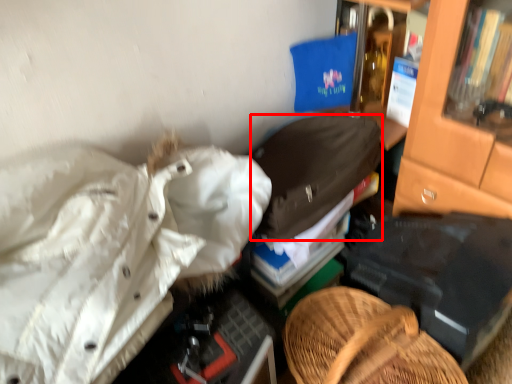
Question: From the image's perspective, what is the correct spatial relationship of clothing (annotated by the red box) in relation to clothing?

Choices:
 (A) above
 (B) below

Answer: (A)